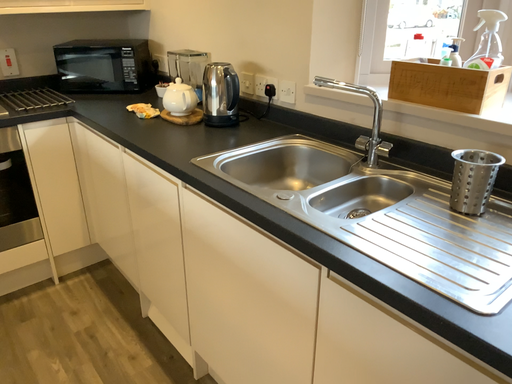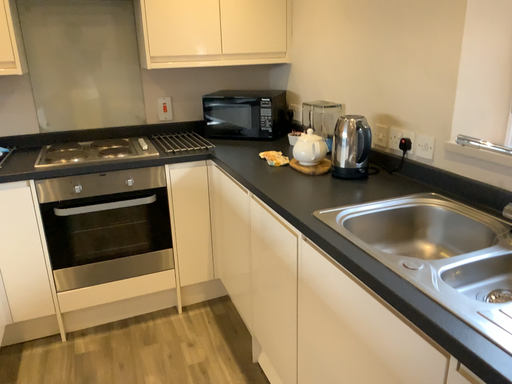
Question: How did the camera likely rotate when shooting the video?

Choices:
 (A) rotated downward
 (B) rotated upward

Answer: (B)